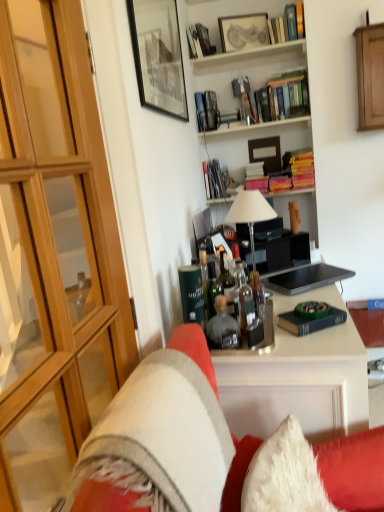
Question: Is the surface of wooden cabinet at upper right, which appears as the first cabinetry when viewed from the right, in direct contact with hardcover books at upper center, which is the 3th book in top-to-bottom order?

Choices:
 (A) yes
 (B) no

Answer: (B)

Question: Is wooden cabinet at upper right, the first cabinetry when ordered from back to front, not close to hardcover books at upper center, arranged as the 3th book when viewed from the front?

Choices:
 (A) yes
 (B) no

Answer: (B)

Question: Is wooden cabinet at upper right, which is the 2th cabinetry from front to back, located outside hardcover books at upper center, which is the 5th book from back to front?

Choices:
 (A) yes
 (B) no

Answer: (A)

Question: Does wooden cabinet at upper right, which appears as the 2th cabinetry when ordered from the bottom, have a greater height compared to hardcover books at upper center, which is the 3th book in top-to-bottom order?

Choices:
 (A) no
 (B) yes

Answer: (B)

Question: Does wooden cabinet at upper right, which appears as the 2th cabinetry when ordered from the bottom, have a larger size compared to hardcover books at upper center, which is the 3th book in top-to-bottom order?

Choices:
 (A) no
 (B) yes

Answer: (A)

Question: Can you confirm if wooden cabinet at upper right, positioned as the second cabinetry in left-to-right order, is smaller than hardcover books at upper center, which is the 5th book from back to front?

Choices:
 (A) yes
 (B) no

Answer: (A)

Question: Considering the relative sizes of hardcover books at upper center, arranged as the 3th book when viewed from the front, and wooden bookshelf at upper center, the 3th shelf in the top-to-bottom sequence, in the image provided, is hardcover books at upper center, arranged as the 3th book when viewed from the front, shorter than wooden bookshelf at upper center, the 3th shelf in the top-to-bottom sequence,?

Choices:
 (A) no
 (B) yes

Answer: (A)

Question: Is hardcover books at upper center, the fifth book when ordered from bottom to top, positioned with its back to wooden bookshelf at upper center, the 3th shelf in the top-to-bottom sequence?

Choices:
 (A) no
 (B) yes

Answer: (A)

Question: Considering the relative positions of hardcover books at upper center, the fifth book when ordered from bottom to top, and wooden bookshelf at upper center, placed as the first shelf when sorted from bottom to top, in the image provided, is hardcover books at upper center, the fifth book when ordered from bottom to top, in front of wooden bookshelf at upper center, placed as the first shelf when sorted from bottom to top,?

Choices:
 (A) no
 (B) yes

Answer: (B)

Question: Considering the relative positions of hardcover books at upper center, arranged as the 3th book when viewed from the front, and wooden bookshelf at upper center, placed as the first shelf when sorted from bottom to top, in the image provided, is hardcover books at upper center, arranged as the 3th book when viewed from the front, to the left of wooden bookshelf at upper center, placed as the first shelf when sorted from bottom to top, from the viewer's perspective?

Choices:
 (A) no
 (B) yes

Answer: (A)

Question: Is hardcover books at upper center, the fifth book when ordered from bottom to top, further to the viewer compared to wooden bookshelf at upper center, placed as the first shelf when sorted from bottom to top?

Choices:
 (A) yes
 (B) no

Answer: (B)

Question: Is hardcover books at upper center, which is the 3th book in top-to-bottom order, with wooden bookshelf at upper center, the 3th shelf in the top-to-bottom sequence?

Choices:
 (A) no
 (B) yes

Answer: (A)

Question: From the image's perspective, is velvet-like beige couch at center located beneath matte black picture frame at upper center, which ranks as the 1th picture frame in back-to-front order?

Choices:
 (A) yes
 (B) no

Answer: (A)